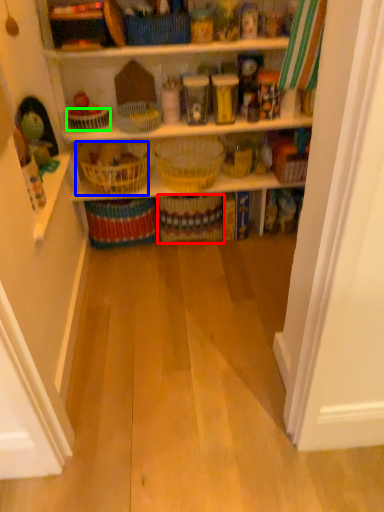
Question: Which object is the closest to the basket (highlighted by a red box)? Choose among these: basket (highlighted by a blue box) or basket (highlighted by a green box).

Choices:
 (A) basket
 (B) basket

Answer: (A)